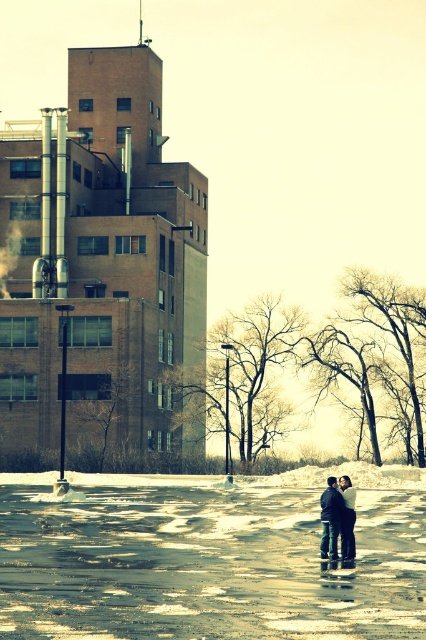
This screenshot has width=426, height=640. What do you see at coordinates (204, 563) in the screenshot?
I see `white frosty snow at lower center` at bounding box center [204, 563].

Looking at this image, which of these two, white frosty snow at lower center or dark blue jeans at center, stands taller?

white frosty snow at lower center is taller.

This screenshot has height=640, width=426. Describe the element at coordinates (204, 563) in the screenshot. I see `white frosty snow at lower center` at that location.

What are the coordinates of `white frosty snow at lower center` in the screenshot? It's located at (204, 563).